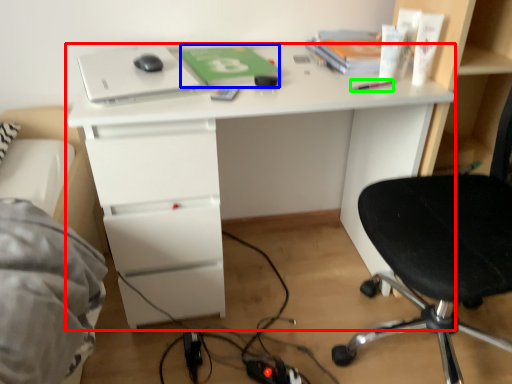
Question: Which object is positioned farthest from desk (highlighted by a red box)? Select from paperback book (highlighted by a blue box) and stationery (highlighted by a green box).

Choices:
 (A) paperback book
 (B) stationery

Answer: (B)